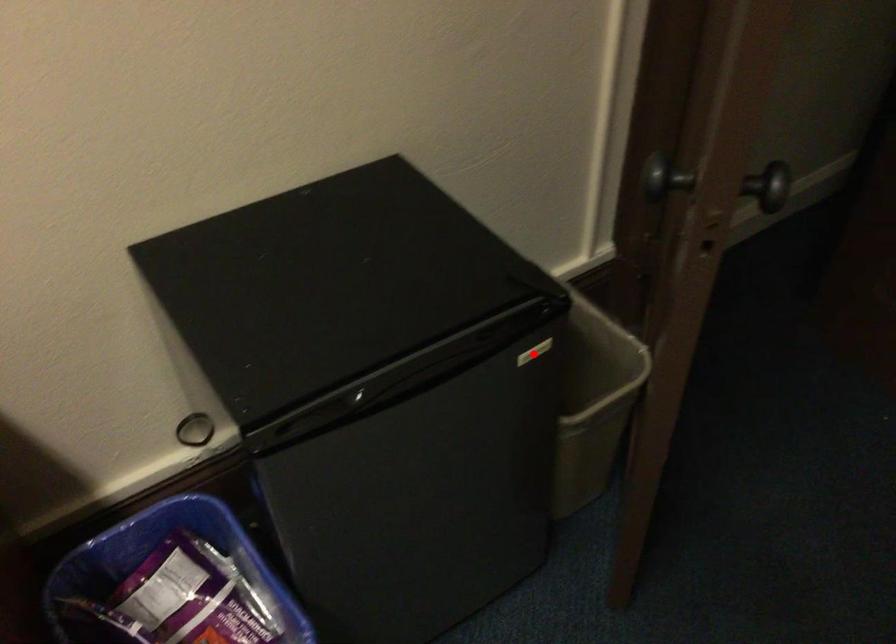
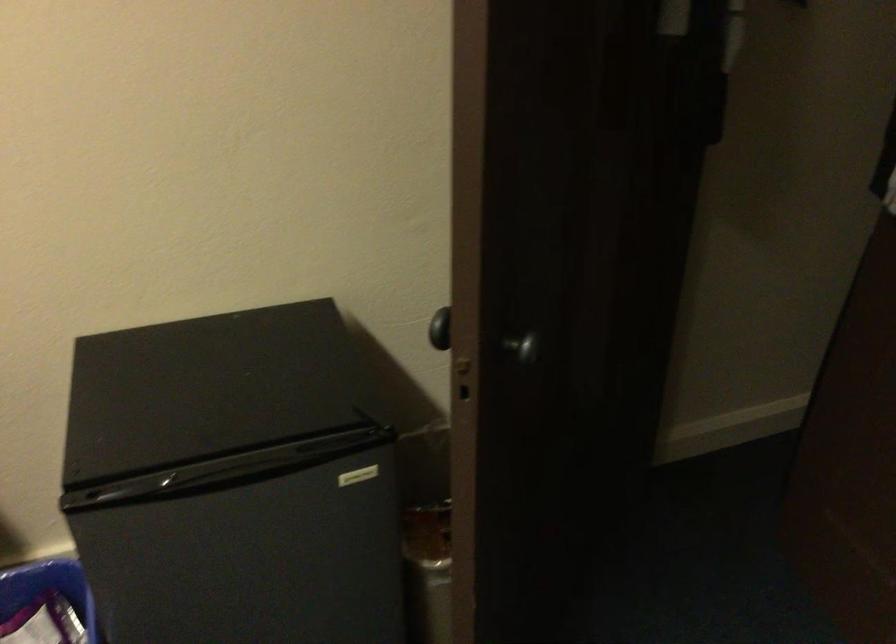
Question: A red point is marked in image1. In image2, is the corresponding 3D point closer to the camera or farther? Reply with the corresponding letter.

Choices:
 (A) The corresponding 3D point is closer.
 (B) The corresponding 3D point is farther.

Answer: (B)